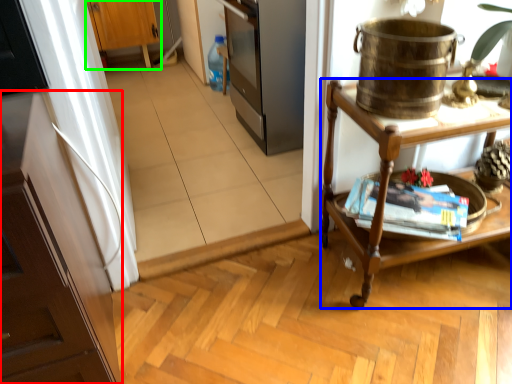
Question: Based on their relative distances, which object is farther from cabinetry (highlighted by a red box)? Choose from desk (highlighted by a blue box) and cabinetry (highlighted by a green box).

Choices:
 (A) desk
 (B) cabinetry

Answer: (B)